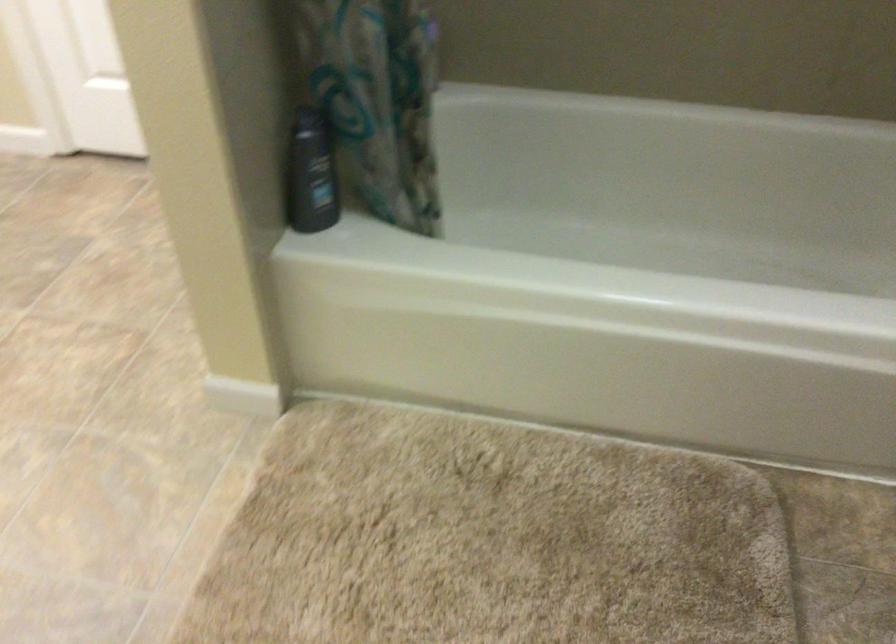
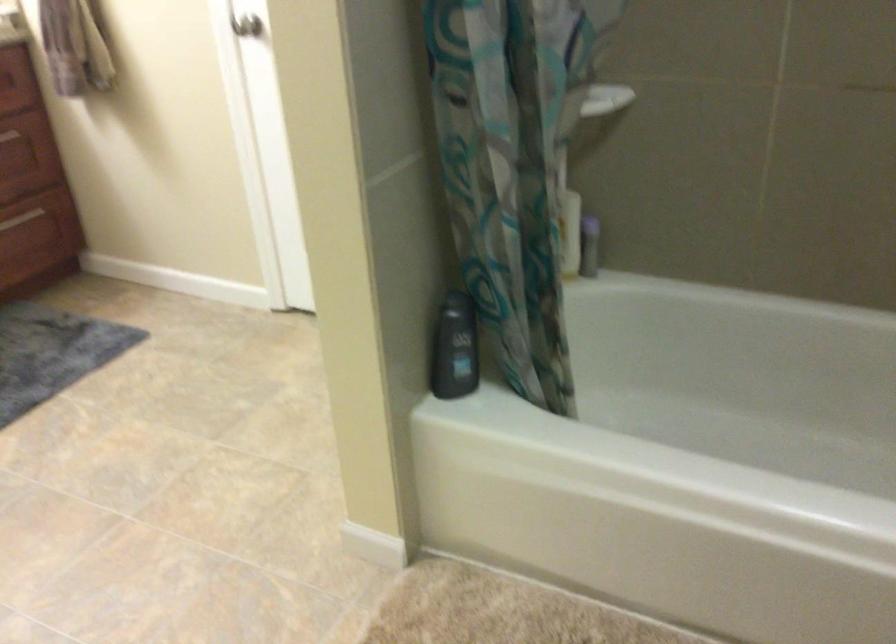
In a continuous first-person perspective shot, in which direction is the camera moving?

The movement direction of the cameraman is right, backward.